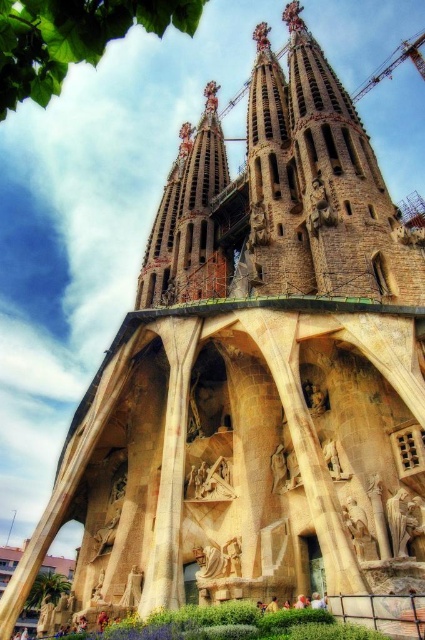
Is wooden carving at center closer to the viewer compared to stone statue at center?

That is False.

Is wooden carving at center to the left of stone statue at center from the viewer's perspective?

Correct, you'll find wooden carving at center to the left of stone statue at center.

Describe the element at coordinates (209, 481) in the screenshot. I see `wooden carving at center` at that location.

I want to click on wooden carving at center, so click(x=209, y=481).